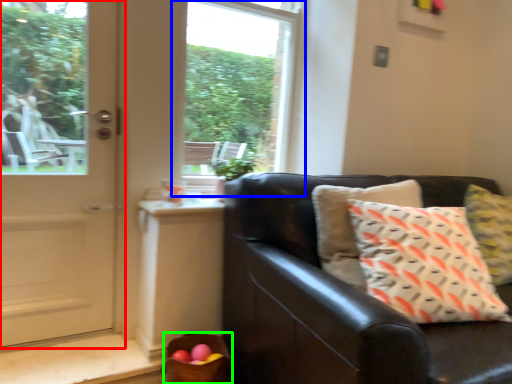
Question: Which is nearer to the door (highlighted by a red box)? window (highlighted by a blue box) or basket (highlighted by a green box).

Choices:
 (A) window
 (B) basket

Answer: (B)